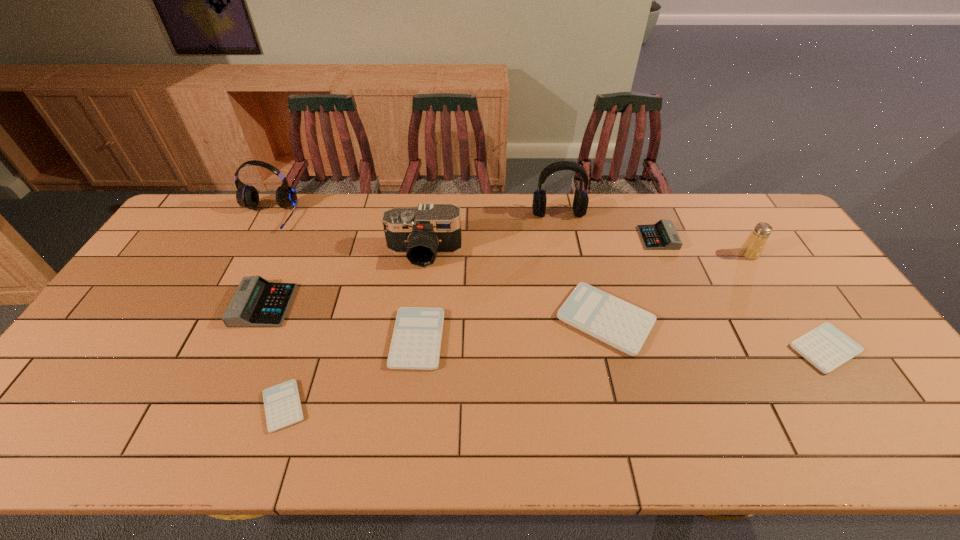
Where is `white calculator object that ranks as the third closest to the rightmost calculator`? white calculator object that ranks as the third closest to the rightmost calculator is located at coordinates (282, 404).

I want to click on vacant point that satisfies the following two spatial constraints: 1. on the ear cushions of the leftmost calculator; 2. on the left side of the left headset, so click(x=220, y=306).

Find the location of a particular element. vacant space that satisfies the following two spatial constraints: 1. on the back side of the fourth tallest object; 2. on the right side of the fourth calculator from left to right is located at coordinates (589, 254).

Find the location of a particular element. free space that satisfies the following two spatial constraints: 1. on the ear cushions of the saltshaker; 2. on the right side of the left headset is located at coordinates 248,254.

The image size is (960, 540). What are the coordinates of `vacant point that satisfies the following two spatial constraints: 1. on the headband of the fourth tallest object; 2. on the left side of the right headset` in the screenshot? It's located at (566, 254).

What are the coordinates of `vacant region that satisfies the following two spatial constraints: 1. on the ear cushions of the tallest calculator; 2. on the left side of the left headset` in the screenshot? It's located at (220, 306).

Image resolution: width=960 pixels, height=540 pixels. In order to click on vacant space that satisfies the following two spatial constraints: 1. on the ear cushions of the left headset; 2. on the right side of the third shortest object in this screenshot , I will do `click(202, 339)`.